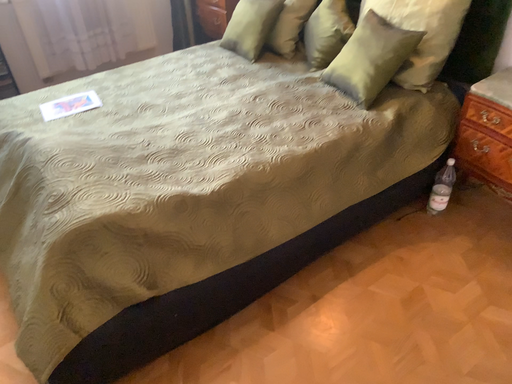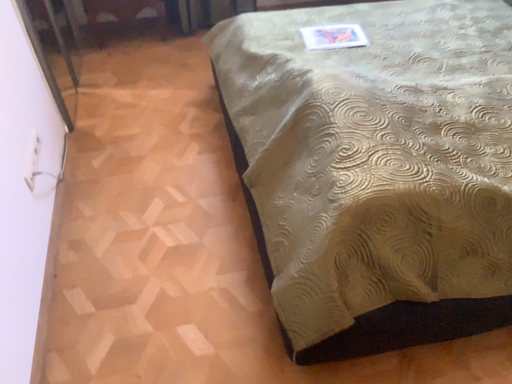
Question: Which way did the camera rotate in the video?

Choices:
 (A) rotated right
 (B) rotated left

Answer: (B)